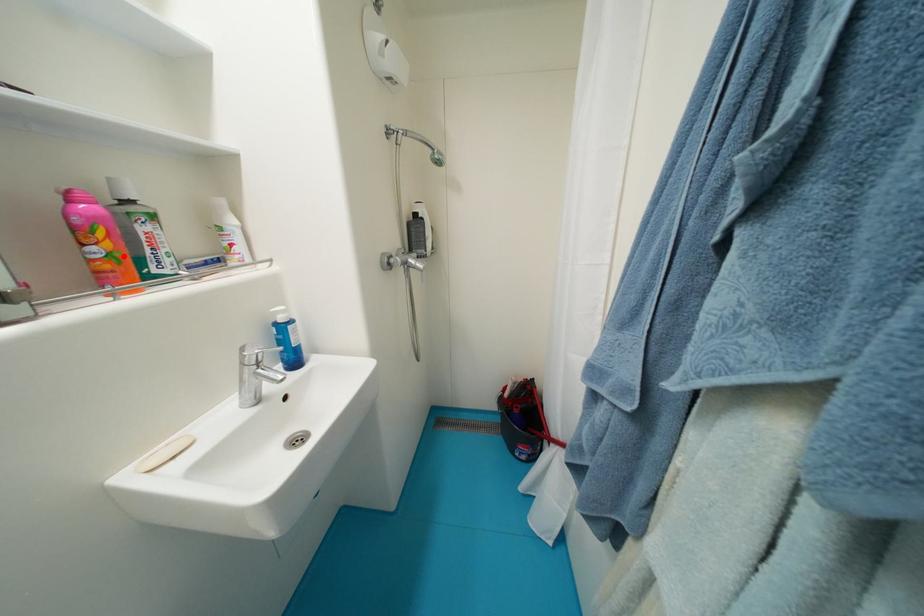
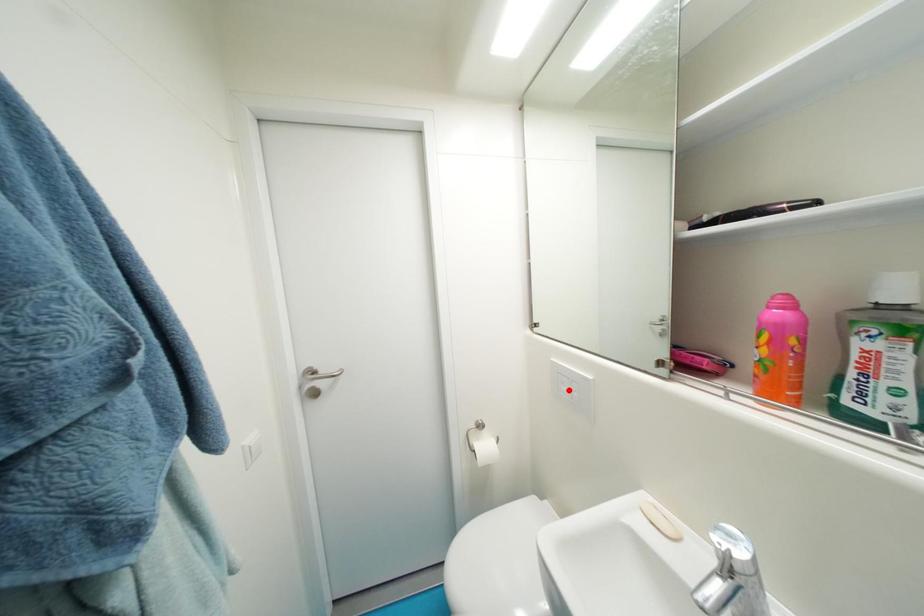
I am providing you with two images of the same scene from different viewpoints. A red point is marked on the first image and another point is marked on the second image. Does the point marked in image1 correspond to the same location as the one in image2?

No